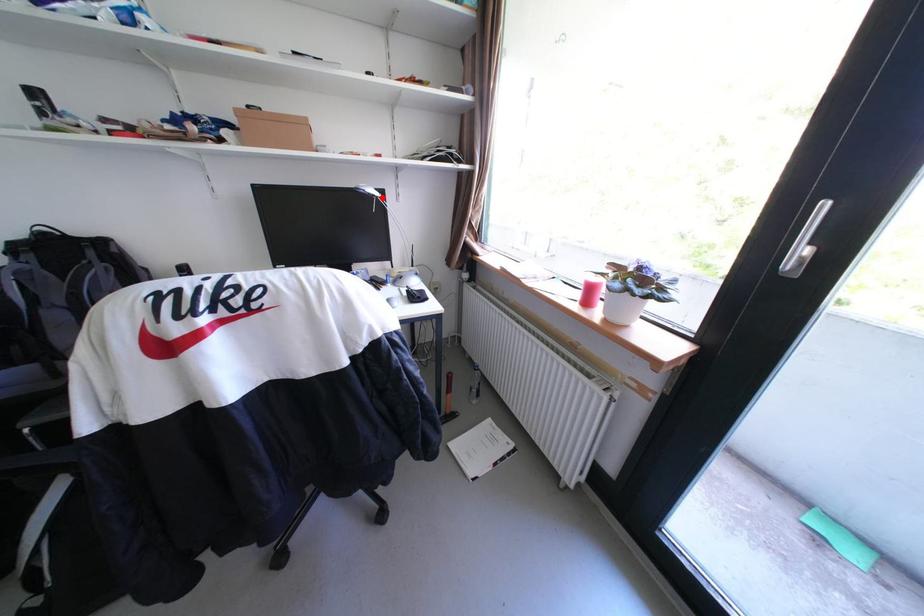
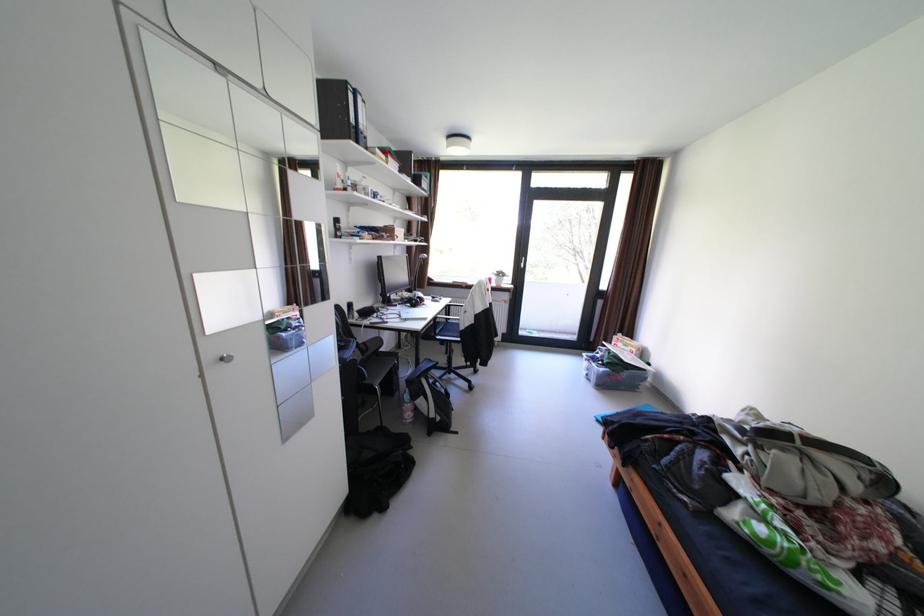
Question: I am providing you with two images of the same scene from different viewpoints. Given a red point in image1, look at the same physical point in image2. Is it:

Choices:
 (A) Closer to the viewpoint
 (B) Farther from the viewpoint

Answer: (A)